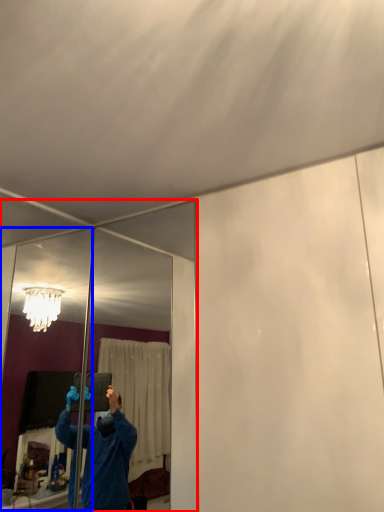
Question: Which point is further to the camera, mirror (highlighted by a red box) or mirror (highlighted by a blue box)?

Choices:
 (A) mirror
 (B) mirror

Answer: (A)